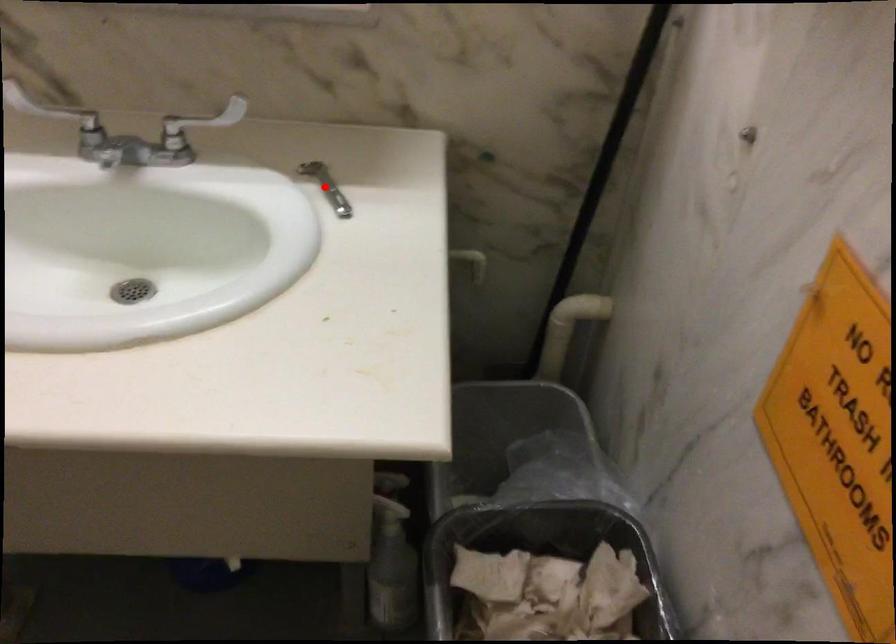
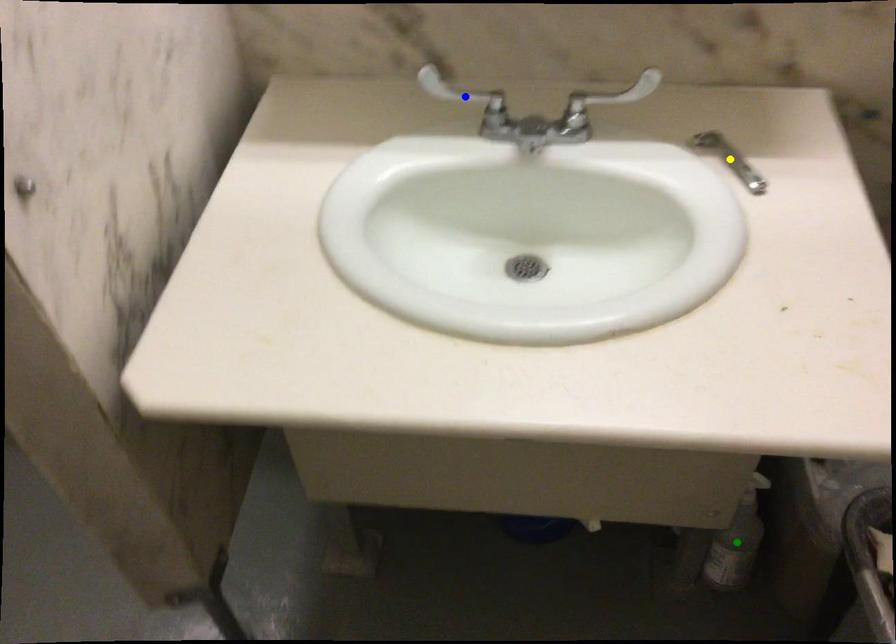
Question: I am providing you with two images of the same scene from different viewpoints. A red point is marked on the first image. You are given multiple points on the second image. Which mark in image 2 goes with the point in image 1?

Choices:
 (A) yellow point
 (B) green point
 (C) blue point

Answer: (A)